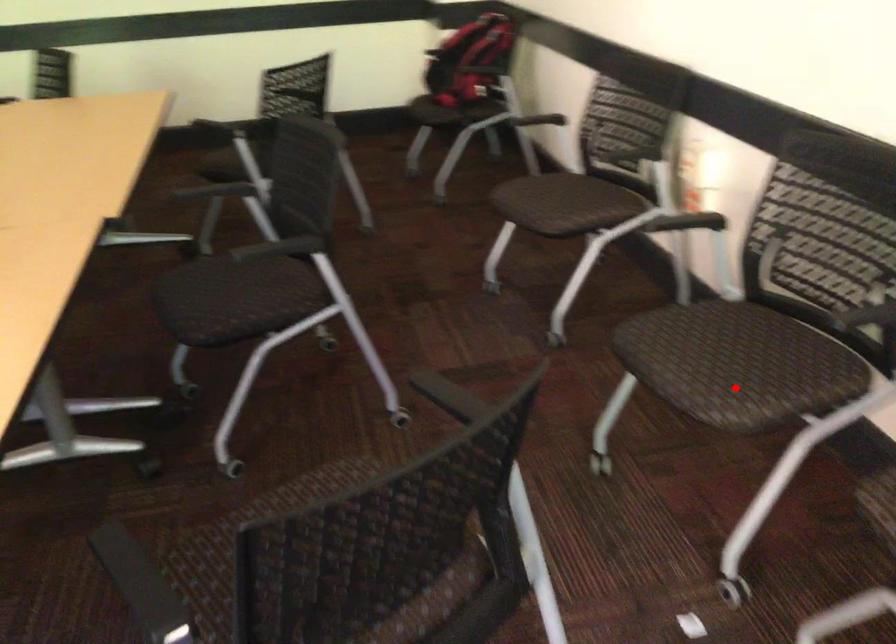
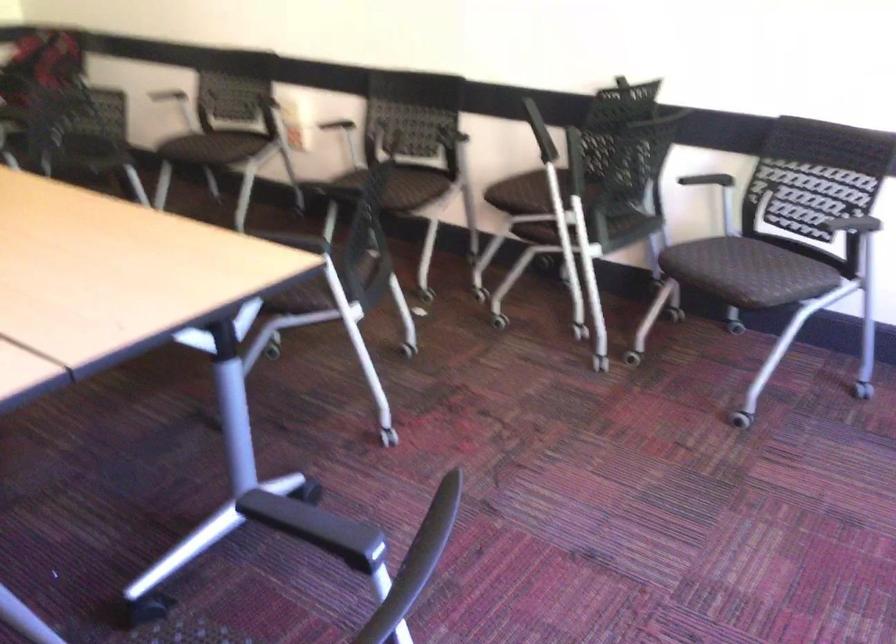
Locate, in the second image, the point that corresponds to the highlighted location in the first image.

(402, 187)